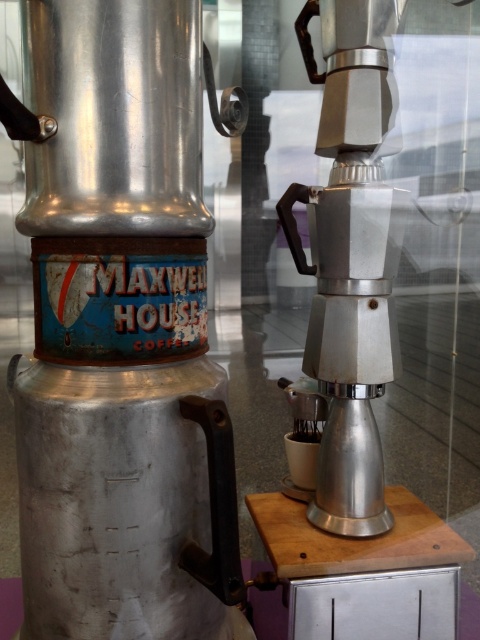
Is shiny metallic coffee maker at center positioned before satin silver coffee machine at center?

Yes, it is.

Between shiny metallic coffee maker at center and satin silver coffee machine at center, which one is positioned higher?

satin silver coffee machine at center is higher up.

Does point (95, 348) lie in front of point (359, 248)?

Yes, it is.

Find the location of a particular element. Image resolution: width=480 pixels, height=640 pixels. shiny metallic coffee maker at center is located at coordinates (121, 333).